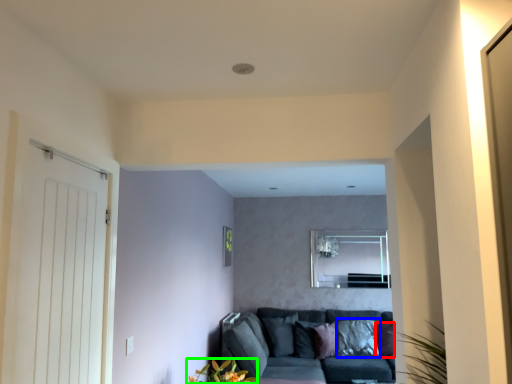
Question: Which object is the closest to the pillow (highlighted by a red box)? Choose among these: pillow (highlighted by a blue box) or floral arrangement (highlighted by a green box).

Choices:
 (A) pillow
 (B) floral arrangement

Answer: (A)